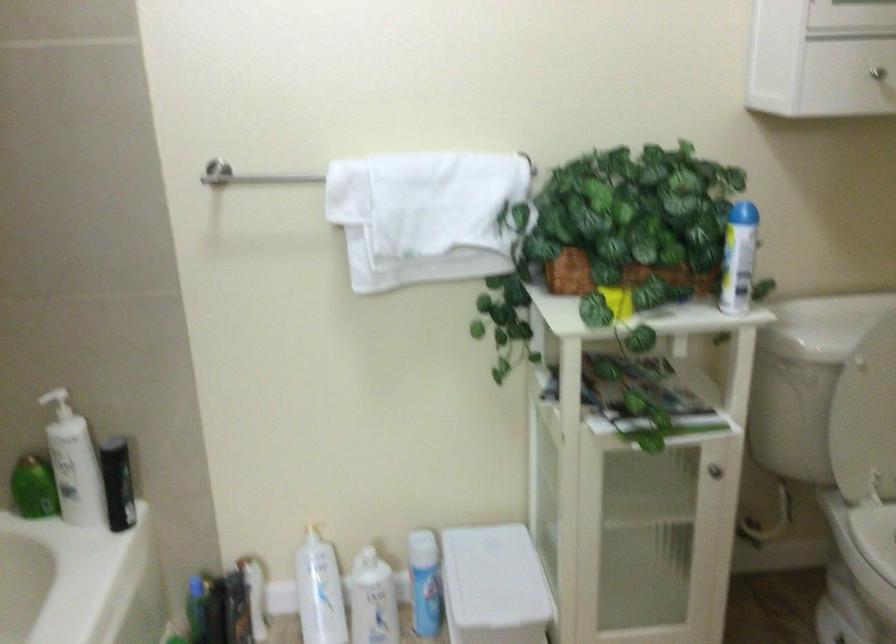
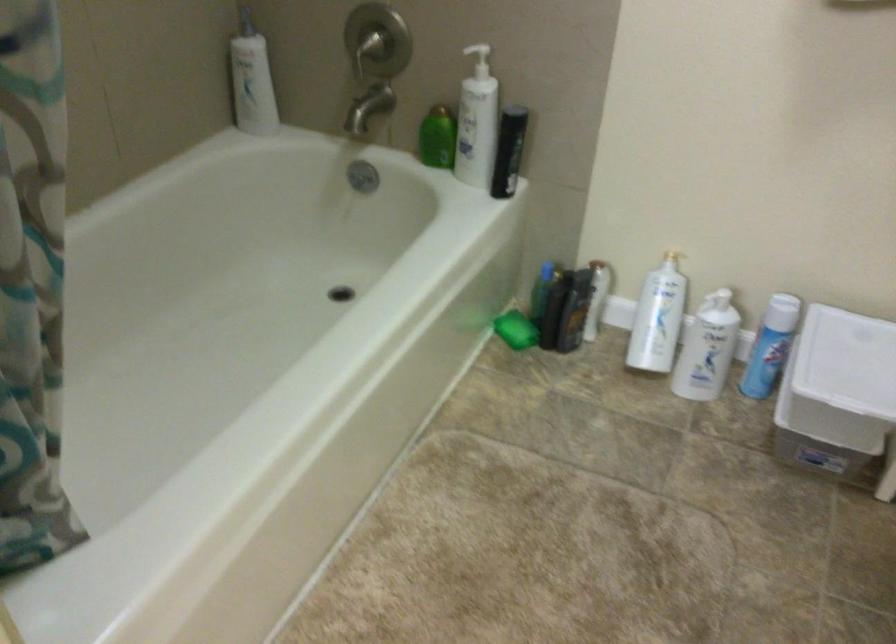
Where in the second image is the point corresponding to (488,576) from the first image?

(847, 361)